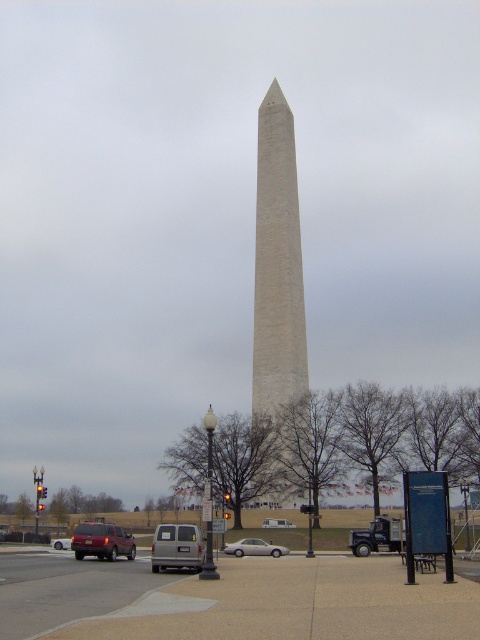
Question: Is the position of silver metallic van at center less distant than that of matte maroon suv at lower left?

Choices:
 (A) yes
 (B) no

Answer: (A)

Question: Which object is closer to the camera taking this photo?

Choices:
 (A) silver metallic van at center
 (B) matte maroon suv at lower left

Answer: (A)

Question: Which point is farther to the camera?

Choices:
 (A) matte red suv at lower left
 (B) white stone obelisk at center
 (C) silver metallic van at center
 (D) silver metallic car at lower center

Answer: (B)

Question: Which point is farther to the camera?

Choices:
 (A) (76, 554)
 (B) (195, 560)
 (C) (286, 298)
 (D) (254, 554)

Answer: (C)

Question: Does silver metallic van at center appear on the right side of silver metallic car at lower center?

Choices:
 (A) yes
 (B) no

Answer: (B)

Question: Is silver metallic car at lower center wider than matte red suv at lower left?

Choices:
 (A) no
 (B) yes

Answer: (A)